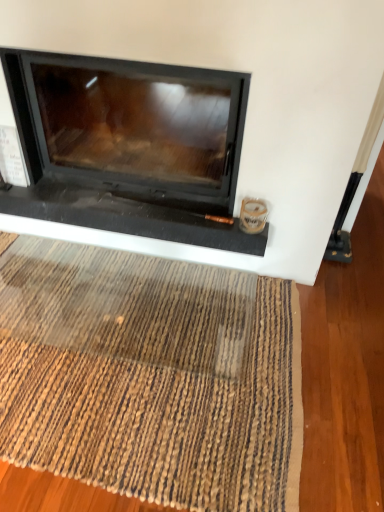
Locate an element on the screen. Image resolution: width=384 pixels, height=512 pixels. free space between black glass fireplace at center and brown woven mat at lower center is located at coordinates (305, 356).